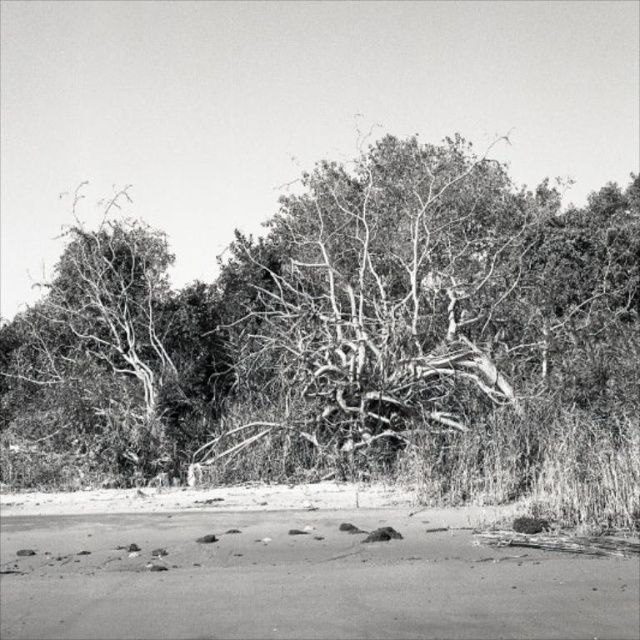
Locate an element on the screen. The height and width of the screenshot is (640, 640). grainy bark tree at center is located at coordinates (324, 323).

Can you confirm if grainy bark tree at center is shorter than smooth sand at lower center?

No, grainy bark tree at center is not shorter than smooth sand at lower center.

At what (x,y) coordinates should I click in order to perform the action: click on grainy bark tree at center. Please return your answer as a coordinate pair (x, y). Looking at the image, I should click on (324, 323).